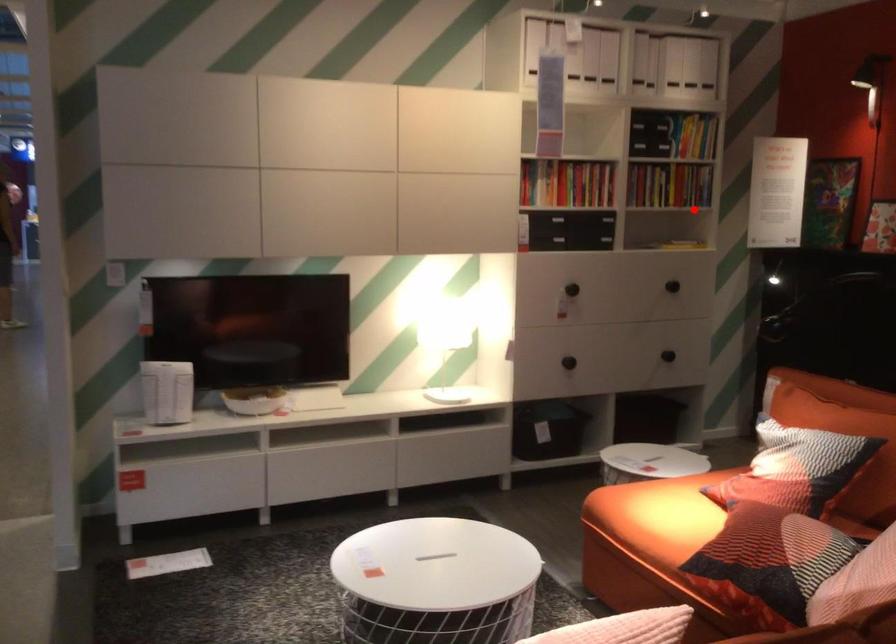
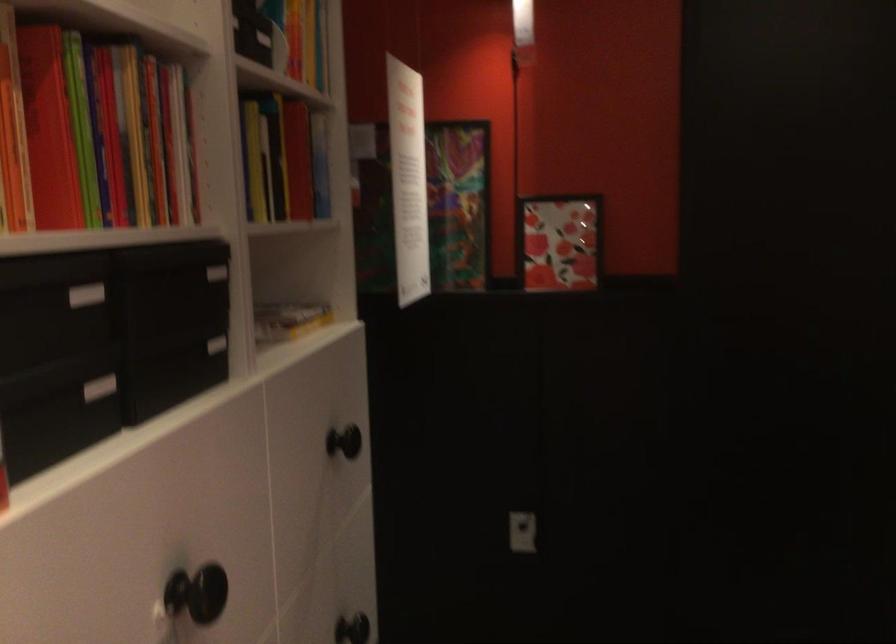
In the second image, find the point that corresponds to the highlighted location in the first image.

(288, 319)